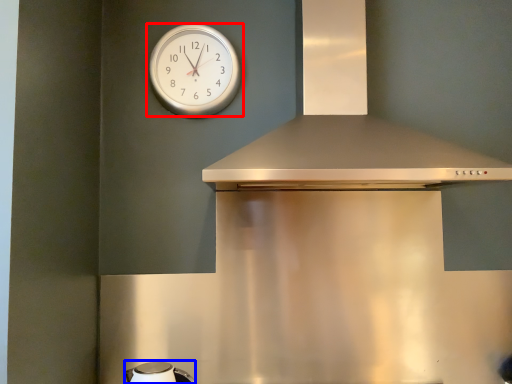
Question: Among these objects, which one is farthest to the camera, wall clock (highlighted by a red box) or appliance (highlighted by a blue box)?

Choices:
 (A) wall clock
 (B) appliance

Answer: (A)